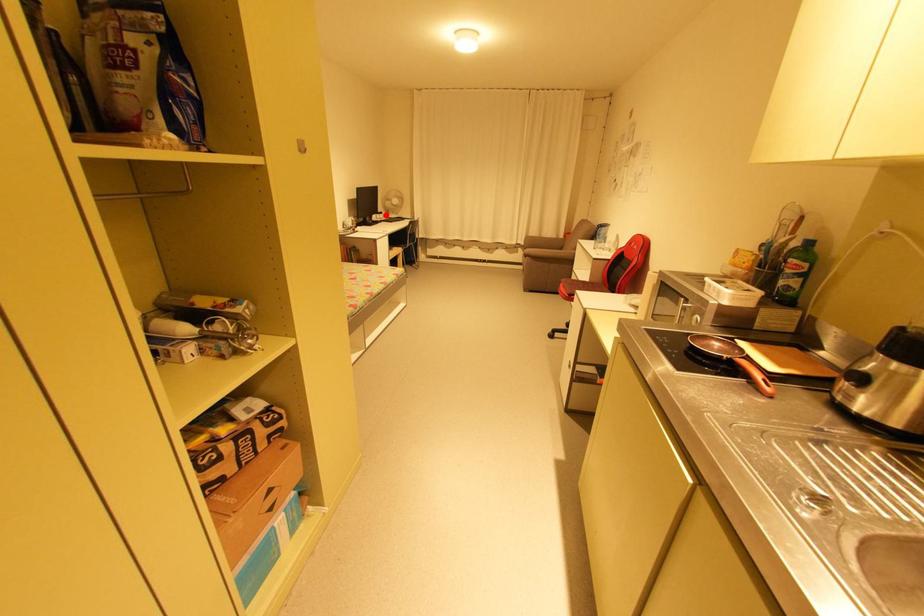
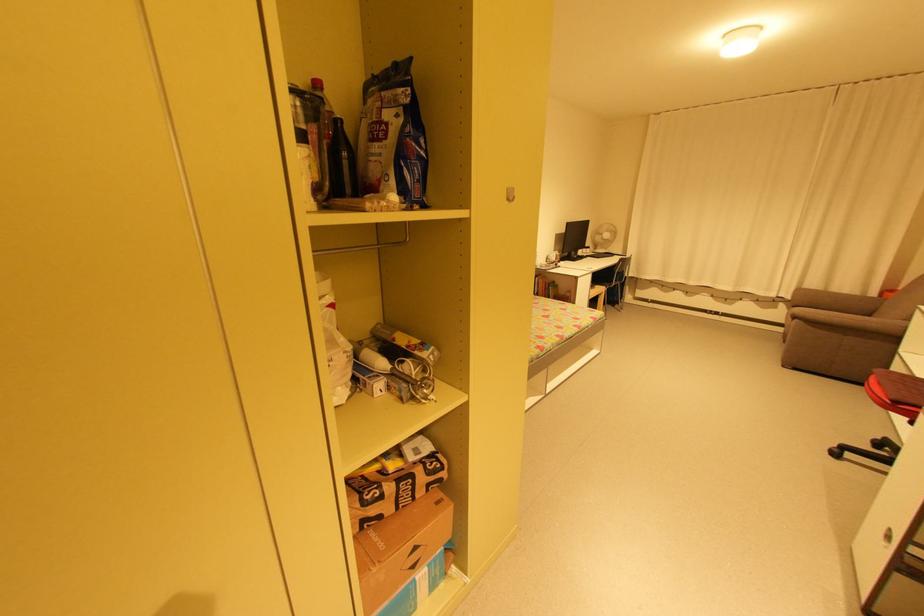
Find the pixel in the second image that matches the highlighted location in the first image.

(592, 249)